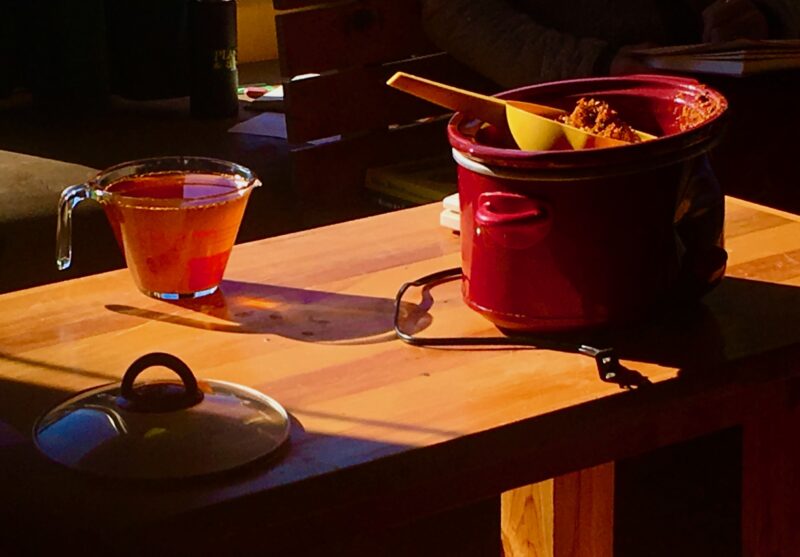
Find the location of a particular element. table top is located at coordinates (330, 334).